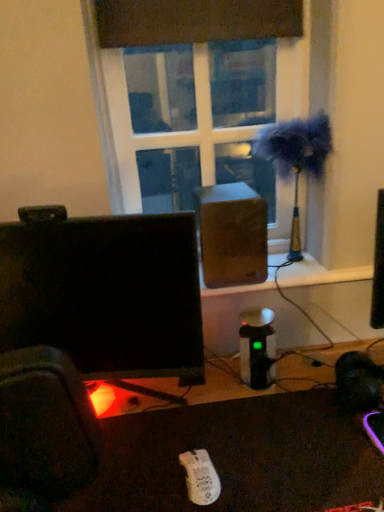
Question: From a real-world perspective, is metallic gold table lamp at upper right over white matte wii controller at lower center?

Choices:
 (A) no
 (B) yes

Answer: (B)

Question: From the image's perspective, is metallic gold table lamp at upper right below white matte wii controller at lower center?

Choices:
 (A) no
 (B) yes

Answer: (A)

Question: Is metallic gold table lamp at upper right further to camera compared to white matte wii controller at lower center?

Choices:
 (A) yes
 (B) no

Answer: (A)

Question: Does metallic gold table lamp at upper right have a greater height compared to white matte wii controller at lower center?

Choices:
 (A) yes
 (B) no

Answer: (A)

Question: Does metallic gold table lamp at upper right have a smaller size compared to white matte wii controller at lower center?

Choices:
 (A) no
 (B) yes

Answer: (A)

Question: Considering the positions of wooden speaker at center and white matte wii controller at lower center in the image, is wooden speaker at center taller or shorter than white matte wii controller at lower center?

Choices:
 (A) tall
 (B) short

Answer: (A)

Question: Choose the correct answer: Is wooden speaker at center inside white matte wii controller at lower center or outside it?

Choices:
 (A) inside
 (B) outside

Answer: (B)

Question: From a real-world perspective, is wooden speaker at center above or below white matte wii controller at lower center?

Choices:
 (A) above
 (B) below

Answer: (A)

Question: Visually, is wooden speaker at center positioned to the left or to the right of white matte wii controller at lower center?

Choices:
 (A) right
 (B) left

Answer: (A)

Question: From a real-world perspective, is black plastic desk at lower center above or below white matte wii controller at lower center?

Choices:
 (A) below
 (B) above

Answer: (B)

Question: From the image's perspective, relative to white matte wii controller at lower center, is black plastic desk at lower center above or below?

Choices:
 (A) above
 (B) below

Answer: (A)

Question: Is black plastic desk at lower center taller or shorter than white matte wii controller at lower center?

Choices:
 (A) short
 (B) tall

Answer: (A)

Question: Is black plastic desk at lower center in front of or behind white matte wii controller at lower center in the image?

Choices:
 (A) behind
 (B) front

Answer: (B)

Question: Is metallic gold table lamp at upper right wider or thinner than transparent glass window at center?

Choices:
 (A) wide
 (B) thin

Answer: (A)

Question: Is metallic gold table lamp at upper right inside the boundaries of transparent glass window at center, or outside?

Choices:
 (A) inside
 (B) outside

Answer: (B)